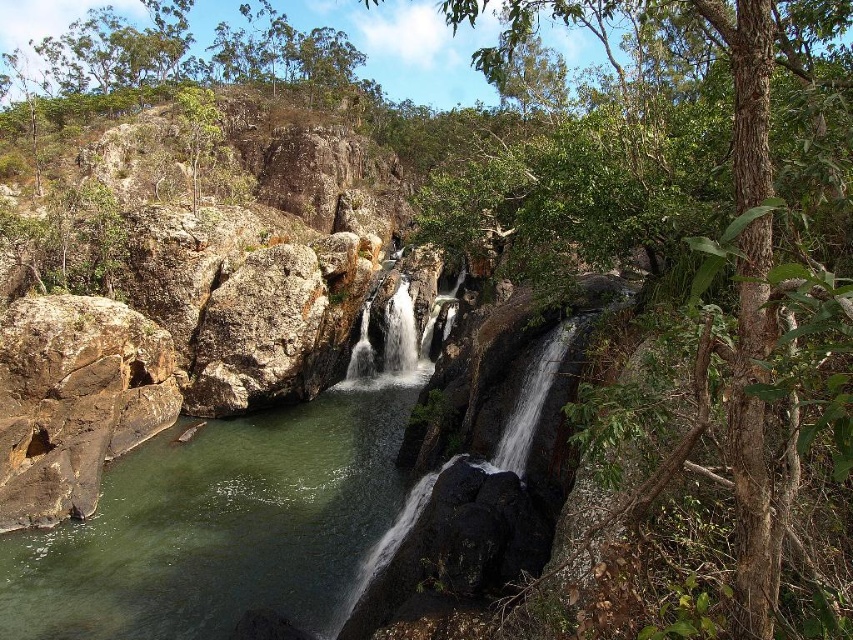
Question: Which object is farther from the camera taking this photo?

Choices:
 (A) rough textured rock at center
 (B) white smooth waterfall at center
 (C) brown rough rock at left

Answer: (B)

Question: Which point is closer to the camera?

Choices:
 (A) (764, 465)
 (B) (381, 317)
 (C) (242, 371)
 (D) (114, 321)

Answer: (A)

Question: Can you confirm if green smooth water at center left is wider than green leafy tree at center?

Choices:
 (A) yes
 (B) no

Answer: (A)

Question: Does green leafy tree at center appear over white smooth waterfall at center?

Choices:
 (A) yes
 (B) no

Answer: (A)

Question: Does brown rough rock at left come in front of rough textured rock at center?

Choices:
 (A) no
 (B) yes

Answer: (B)

Question: Which is farther from the white smooth waterfall at center?

Choices:
 (A) rough textured rock at center
 (B) green leafy tree at center
 (C) brown rough rock at left
 (D) green smooth water at center left

Answer: (B)